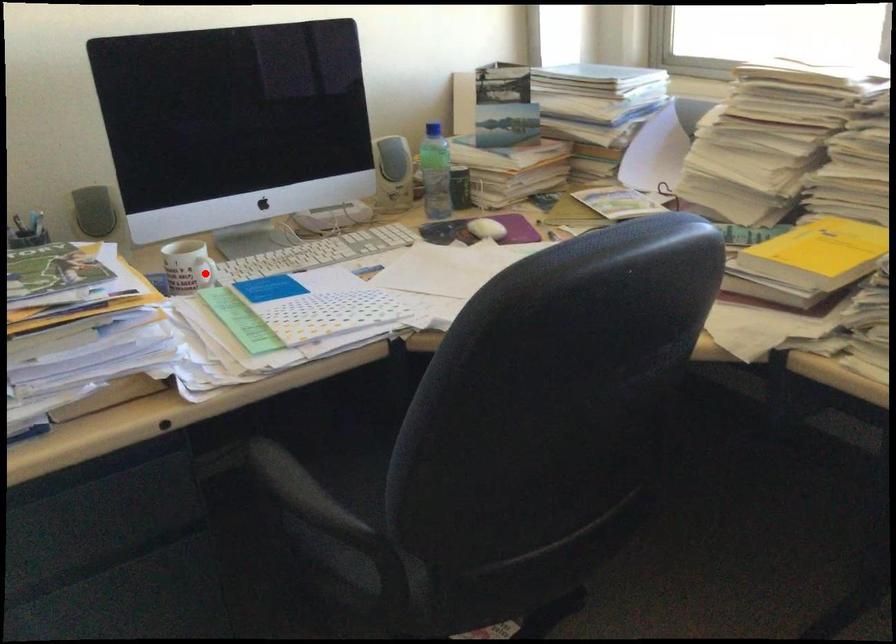
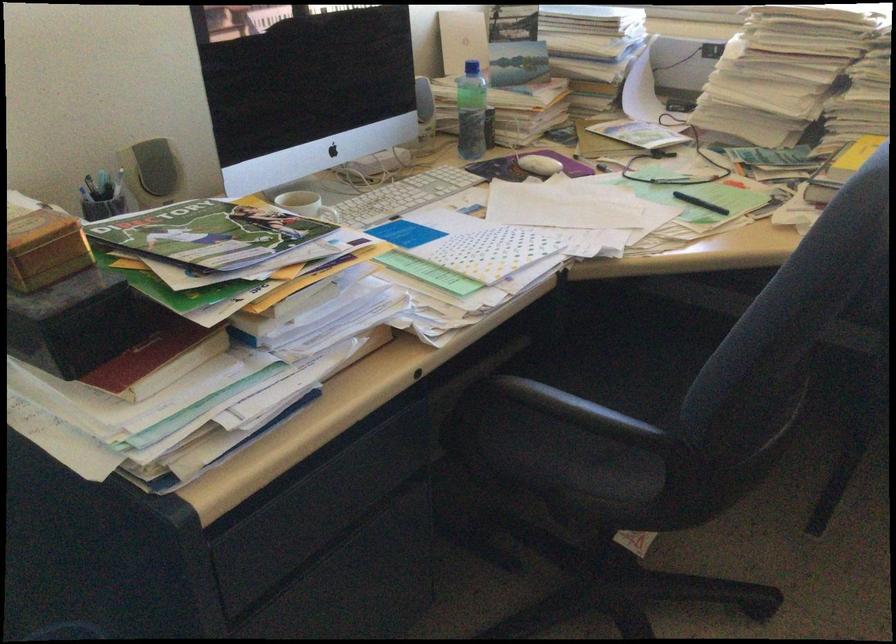
Question: I am providing you with two images of the same scene from different viewpoints. A red point is marked on the first image. Can you still see the location of the red point in image 2?

Choices:
 (A) Yes
 (B) No

Answer: (B)